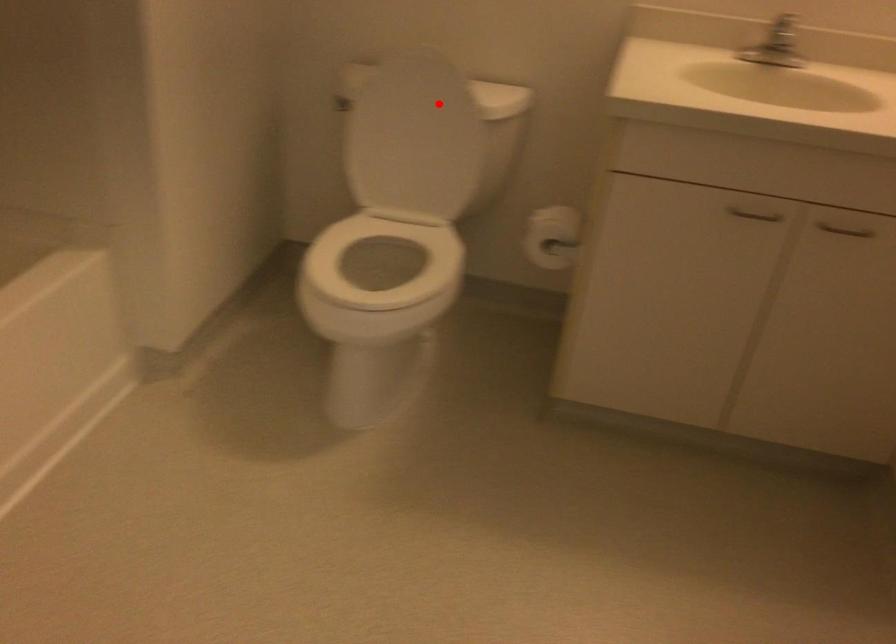
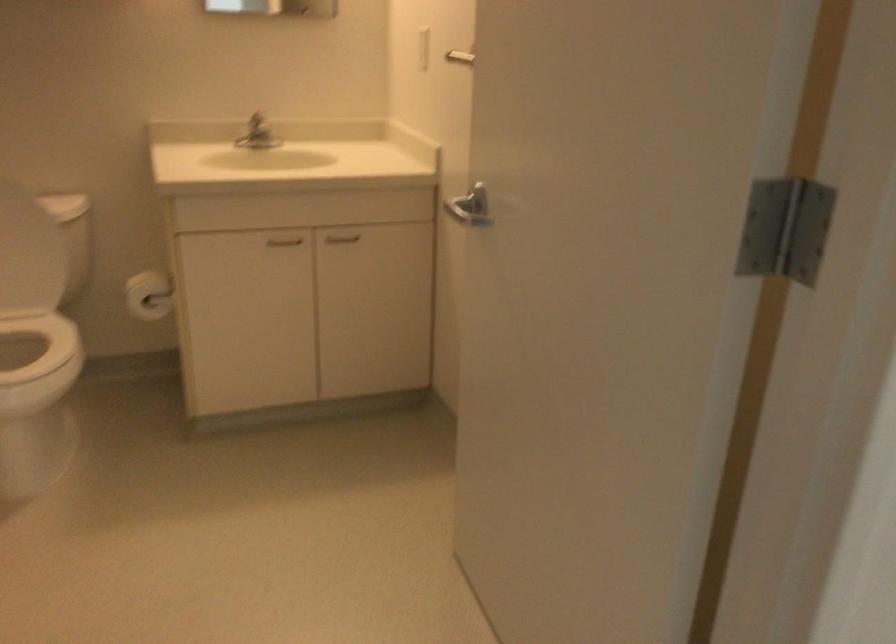
Question: I am providing you with two images of the same scene from different viewpoints. Given a red point in image1, look at the same physical point in image2. Is it:

Choices:
 (A) Closer to the viewpoint
 (B) Farther from the viewpoint

Answer: (B)